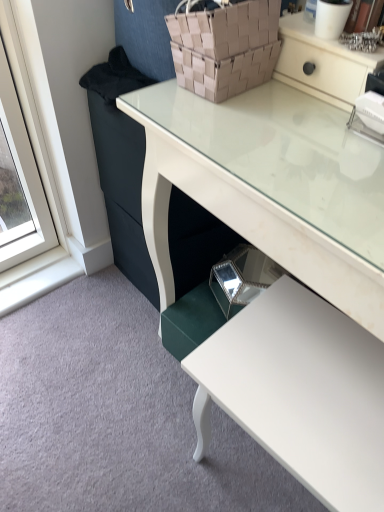
The width and height of the screenshot is (384, 512). Identify the location of vacant region above white glossy desk at center (from a real-world perspective). (276, 124).